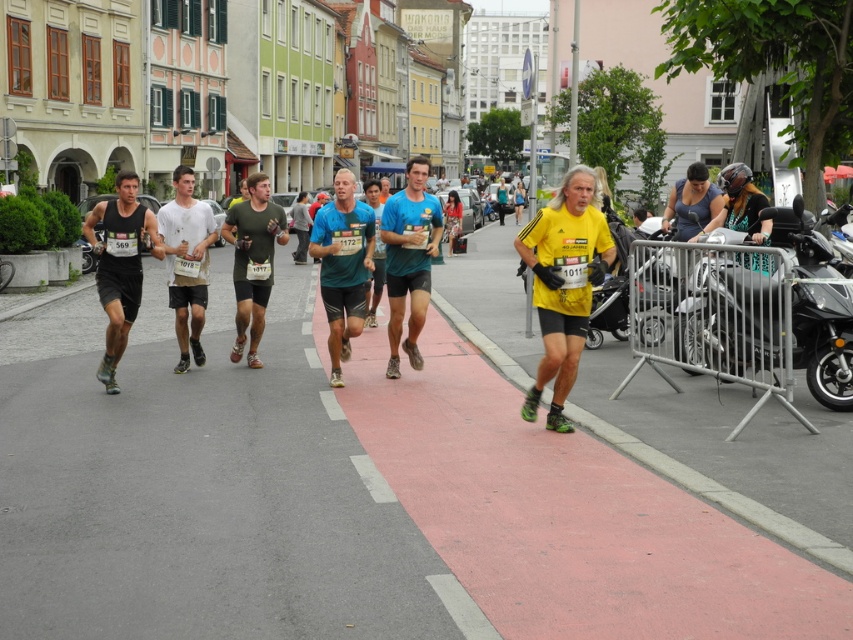
Question: Which point is farther to the camera?

Choices:
 (A) (180, 202)
 (B) (253, 282)

Answer: (B)

Question: Is yellow matte shirt at center bigger than teal matte shirt at center?

Choices:
 (A) yes
 (B) no

Answer: (B)

Question: Is teal matte shirt at center in front of teal matte shorts at center?

Choices:
 (A) no
 (B) yes

Answer: (B)

Question: Where is white matte shorts at center located in relation to green matte t-shirt at center in the image?

Choices:
 (A) left
 (B) right

Answer: (A)

Question: Which of these objects is positioned farthest from the white matte shorts at center?

Choices:
 (A) matte black shorts at left
 (B) teal matte shorts at center
 (C) teal matte shirt at center
 (D) green matte t-shirt at center

Answer: (B)

Question: Which of the following is the closest to the observer?

Choices:
 (A) yellow matte shirt at center
 (B) matte black shorts at left
 (C) green matte t-shirt at center
 (D) teal matte shirt at center

Answer: (A)